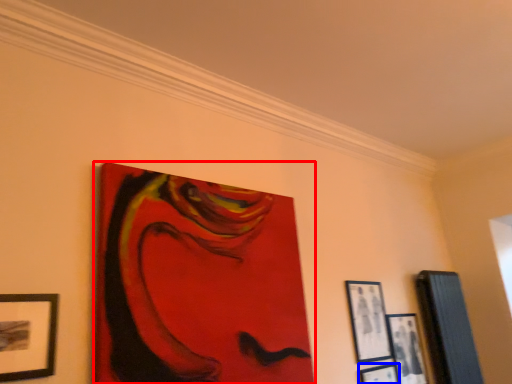
Question: Among these objects, which one is nearest to the camera, picture frame (highlighted by a red box) or picture frame (highlighted by a blue box)?

Choices:
 (A) picture frame
 (B) picture frame

Answer: (A)